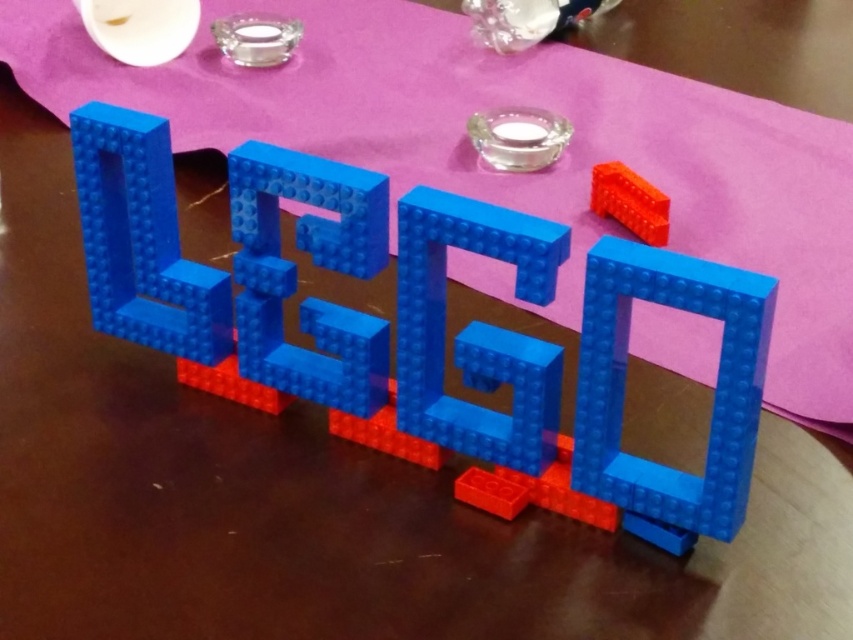
Is translucent blue plastic square at center bigger than blue plastic letter l at center?

Actually, translucent blue plastic square at center might be smaller than blue plastic letter l at center.

Can you confirm if translucent blue plastic square at center is wider than blue plastic letter l at center?

Incorrect, translucent blue plastic square at center's width does not surpass blue plastic letter l at center's.

I want to click on translucent blue plastic square at center, so click(712, 397).

Where is `translucent blue plastic square at center`? translucent blue plastic square at center is located at coordinates (712, 397).

Describe the element at coordinates (474, 330) in the screenshot. This screenshot has height=640, width=853. I see `blue plastic letter g at center` at that location.

Can you confirm if blue plastic letter g at center is positioned above blue plastic letter l at center?

No.

At what (x,y) coordinates should I click in order to perform the action: click on blue plastic letter g at center. Please return your answer as a coordinate pair (x, y). The width and height of the screenshot is (853, 640). Looking at the image, I should click on pos(474,330).

Describe the element at coordinates (474, 330) in the screenshot. I see `blue plastic letter g at center` at that location.

Does blue plastic letter g at center appear under rubber brick at upper right?

Yes, blue plastic letter g at center is below rubber brick at upper right.

Locate an element on the screen. The height and width of the screenshot is (640, 853). blue plastic letter g at center is located at coordinates (474, 330).